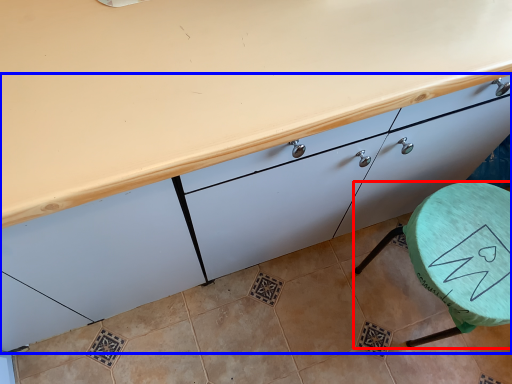
Question: Which object is closer to the camera taking this photo, furniture (highlighted by a red box) or cabinetry (highlighted by a blue box)?

Choices:
 (A) furniture
 (B) cabinetry

Answer: (B)